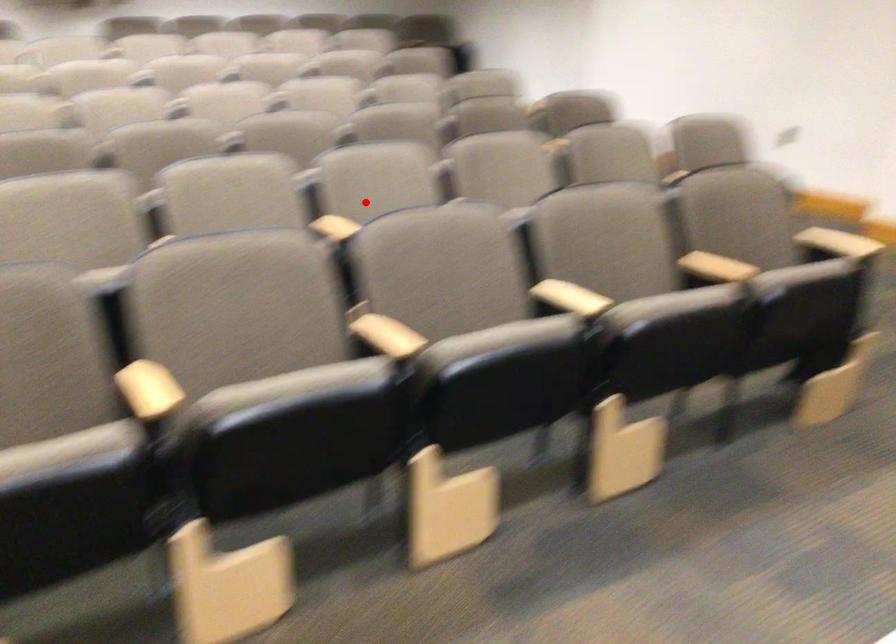
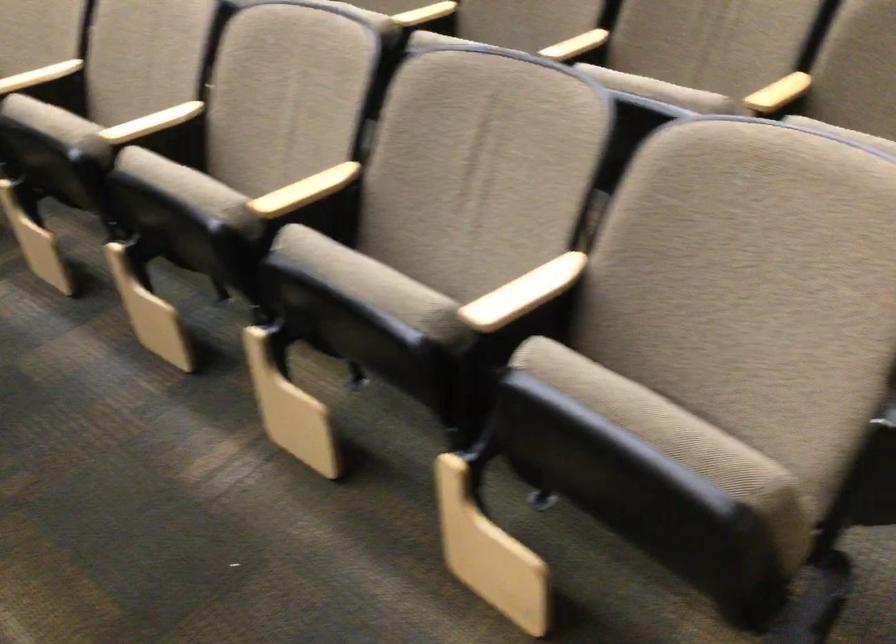
Where in the second image is the point corresponding to the highlighted location from the first image?

(39, 76)